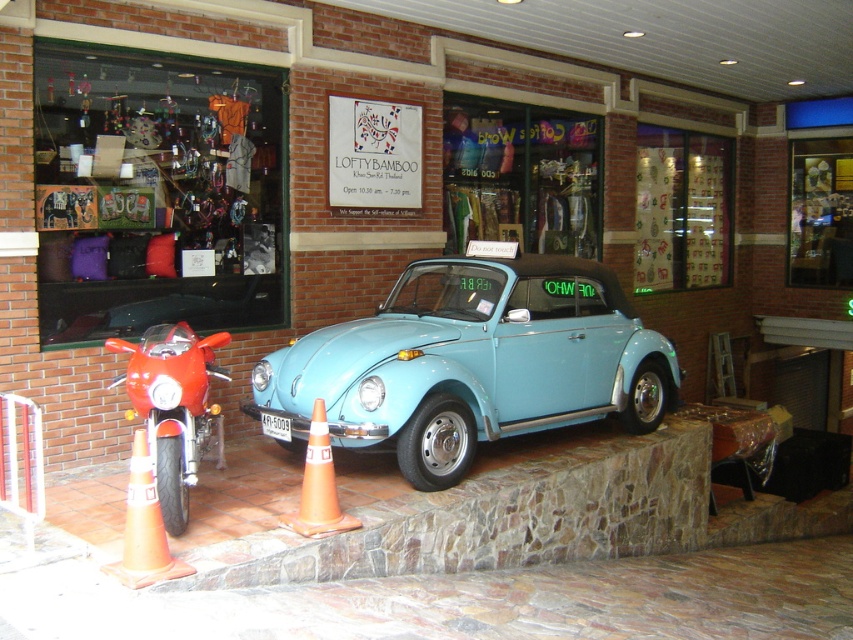
Question: Can you confirm if matte glass display case at center is positioned above musical note wallpaper at upper right?

Choices:
 (A) no
 (B) yes

Answer: (B)

Question: Can you confirm if orange plastic traffic cone at lower left is wider than orange plastic traffic cone at lower center?

Choices:
 (A) yes
 (B) no

Answer: (B)

Question: Which of the following is the closest to the observer?

Choices:
 (A) orange plastic traffic cone at lower center
 (B) white plastic license plate at center
 (C) shiny red motorcycle at left

Answer: (C)

Question: Which point is closer to the camera?

Choices:
 (A) orange plastic traffic cone at lower left
 (B) shiny red motorcycle at left
 (C) light blue matte car at center
 (D) white plastic license plate at center

Answer: (A)

Question: Which of these objects is positioned closest to the musical note wallpaper at upper right?

Choices:
 (A) orange plastic traffic cone at lower left
 (B) orange plastic traffic cone at lower center
 (C) light blue matte car at center

Answer: (C)

Question: Does matte glass window at upper left lie behind shiny red motorcycle at left?

Choices:
 (A) no
 (B) yes

Answer: (B)